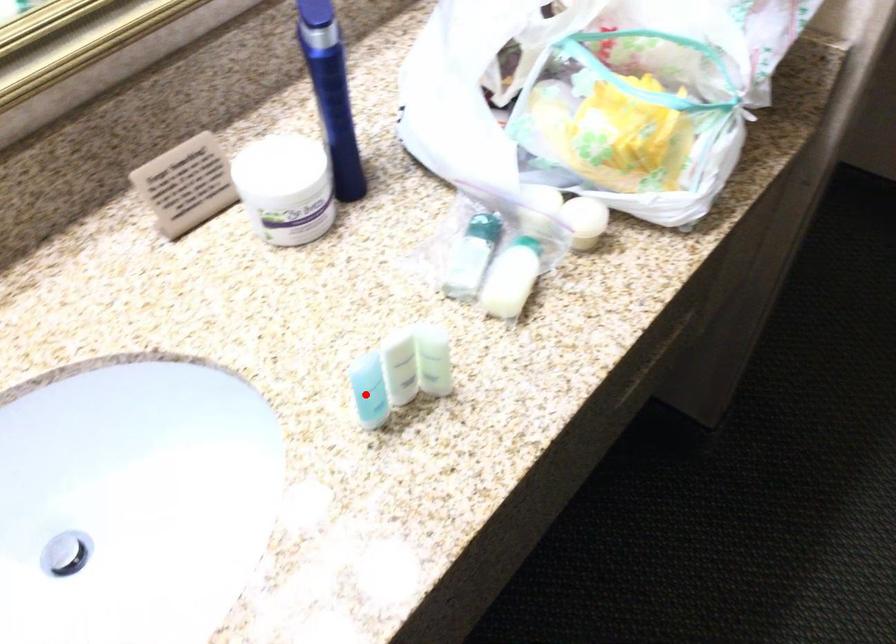
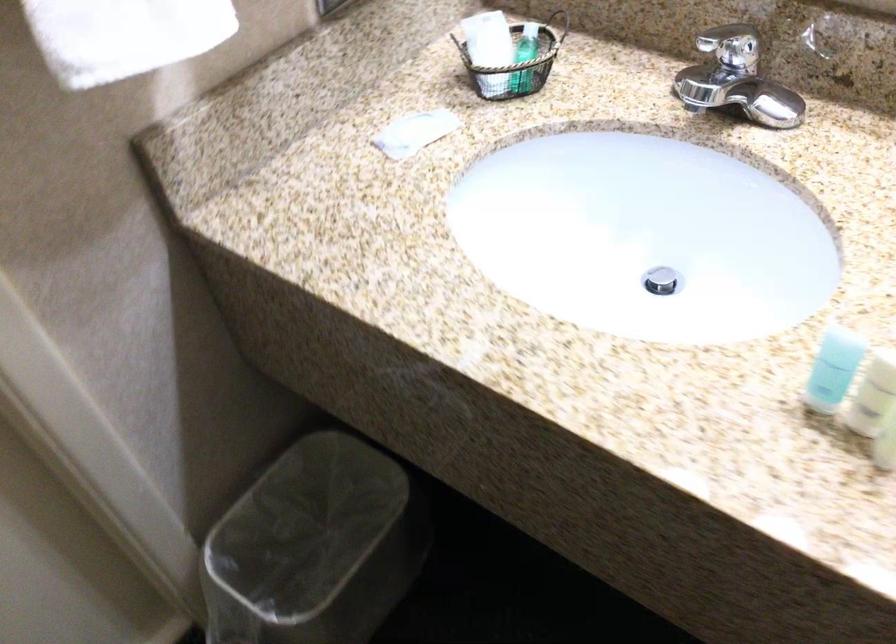
Find the pixel in the second image that matches the highlighted location in the first image.

(833, 368)